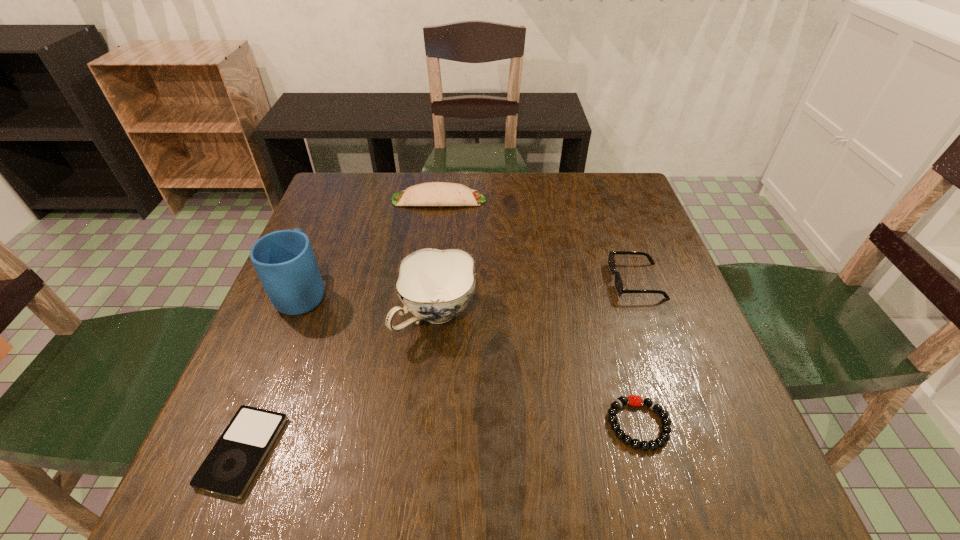
The height and width of the screenshot is (540, 960). In order to click on vacant position located 0.050m on the front-facing side of the sunglasses in this screenshot , I will do `click(589, 281)`.

Find the location of a particular element. blank space located 0.270m on the front-facing side of the sunglasses is located at coordinates (494, 281).

Locate an element on the screen. The width and height of the screenshot is (960, 540). vacant area located on the front-facing side of the sunglasses is located at coordinates (499, 281).

Image resolution: width=960 pixels, height=540 pixels. In order to click on vacant space located 0.130m at the bitten end of the burrito in this screenshot , I will do `click(531, 200)`.

At what (x,y) coordinates should I click in order to perform the action: click on vacant space situated on the right of the bracelet. Please return your answer as a coordinate pair (x, y). Looking at the image, I should click on (727, 424).

This screenshot has width=960, height=540. In order to click on vacant space situated 0.270m on the right of the iPod in this screenshot , I will do `click(440, 451)`.

This screenshot has height=540, width=960. I want to click on object that is at the far edge, so click(431, 193).

Find the location of a particular element. This screenshot has width=960, height=540. bracelet located at the near edge is located at coordinates (x=664, y=436).

What are the coordinates of `iPod at the near edge` in the screenshot? It's located at (232, 463).

Identify the location of mug present at the left edge. The width and height of the screenshot is (960, 540). (284, 260).